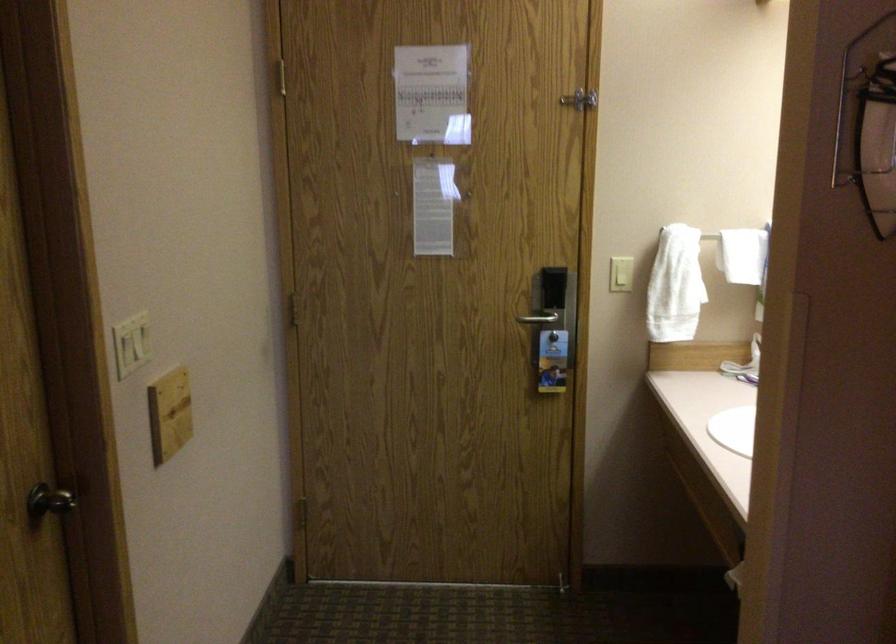
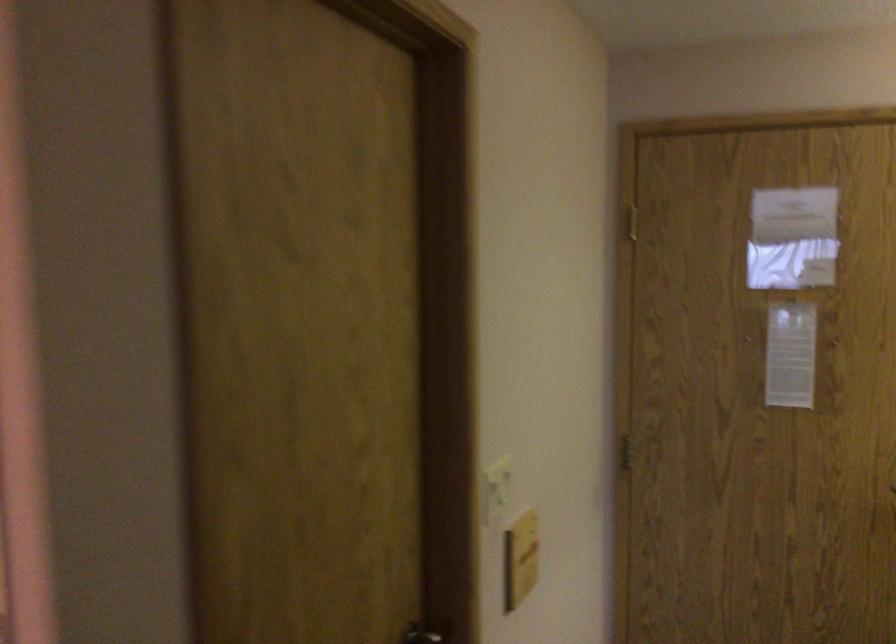
Question: In a continuous first-person perspective shot, in which direction is the camera moving?

Choices:
 (A) Left
 (B) Right
 (C) Forward
 (D) Backward

Answer: (A)